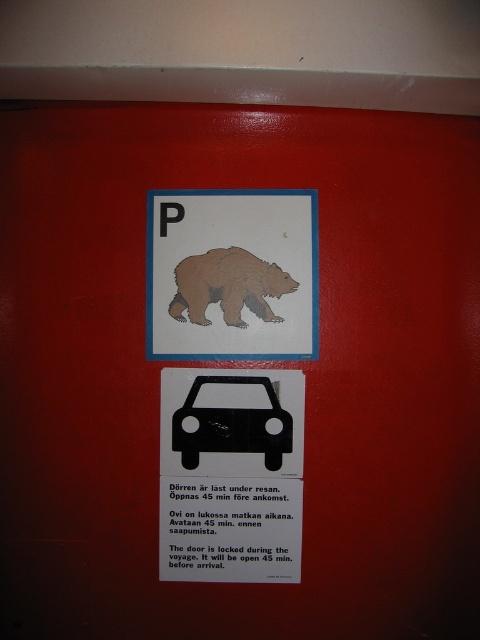
Who is positioned more to the right, brown cardboard bear at center or black matte car at center?

From the viewer's perspective, black matte car at center appears more on the right side.

Which is above, brown cardboard bear at center or black matte car at center?

Positioned higher is brown cardboard bear at center.

The height and width of the screenshot is (640, 480). I want to click on brown cardboard bear at center, so [x=228, y=285].

Who is more forward, (182, 305) or (197, 260)?

Positioned in front is point (182, 305).

Does cardboard bear at upper center appear under brown cardboard bear at center?

Actually, cardboard bear at upper center is above brown cardboard bear at center.

Where is `cardboard bear at upper center`? The height and width of the screenshot is (640, 480). cardboard bear at upper center is located at coordinates (231, 275).

Can you confirm if cardboard bear at upper center is positioned to the right of black matte car at center?

Incorrect, cardboard bear at upper center is not on the right side of black matte car at center.

Does cardboard bear at upper center have a lesser height compared to black matte car at center?

No, cardboard bear at upper center is not shorter than black matte car at center.

Does point (146, 260) come closer to viewer compared to point (200, 428)?

No, it is not.

Identify the location of cardboard bear at upper center. (231, 275).